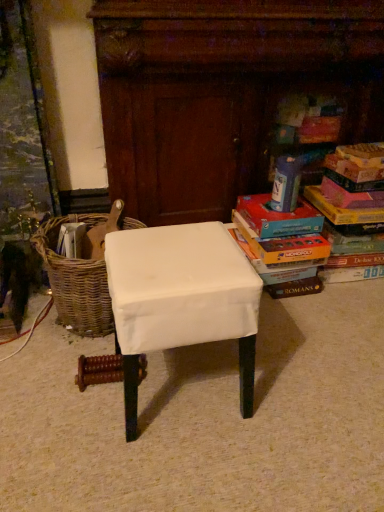
What are the coordinates of `free point to the left of hardcover book at upper right` in the screenshot? It's located at (255, 207).